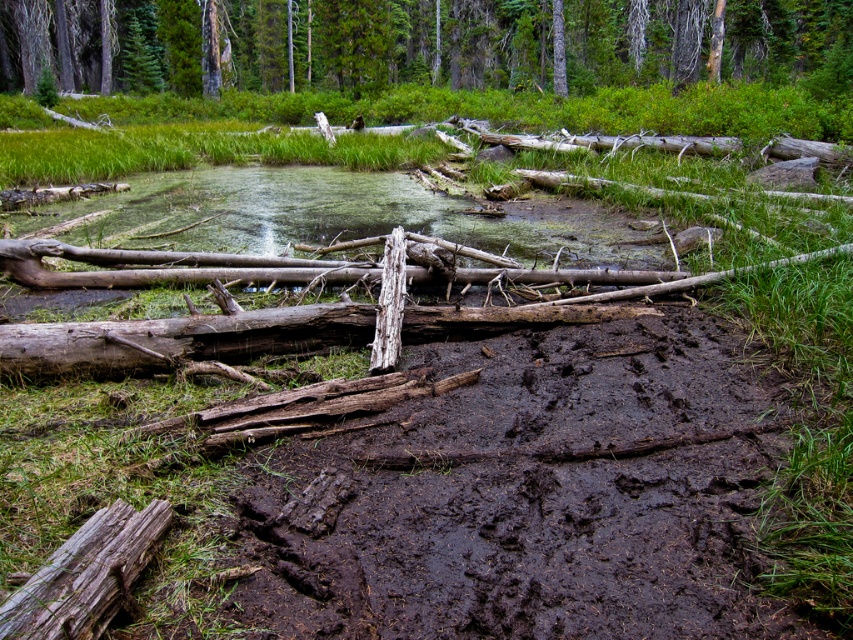
Is green matte tree at upper center further to the viewer compared to weathered brown log at lower left?

That is True.

Can you confirm if green matte tree at upper center is taller than weathered brown log at lower left?

Indeed, green matte tree at upper center has a greater height compared to weathered brown log at lower left.

Between point (238, 38) and point (70, 586), which one is positioned behind?

The point (238, 38) is behind.

This screenshot has height=640, width=853. In order to click on green matte tree at upper center in this screenshot , I will do coord(422,42).

In the scene shown: Can you confirm if dark brown mud at center is positioned below green matte tree at upper center?

Yes.

Which is below, dark brown mud at center or green matte tree at upper center?

dark brown mud at center is lower down.

What do you see at coordinates (526, 497) in the screenshot?
I see `dark brown mud at center` at bounding box center [526, 497].

This screenshot has width=853, height=640. In order to click on dark brown mud at center in this screenshot , I will do `click(526, 497)`.

Does dark brown mud at center appear over weathered brown log at lower left?

Correct, dark brown mud at center is located above weathered brown log at lower left.

Can you confirm if dark brown mud at center is thinner than weathered brown log at lower left?

In fact, dark brown mud at center might be wider than weathered brown log at lower left.

Is point (442, 481) more distant than point (42, 636)?

Yes, point (442, 481) is farther from viewer.

Identify the location of dark brown mud at center. (526, 497).